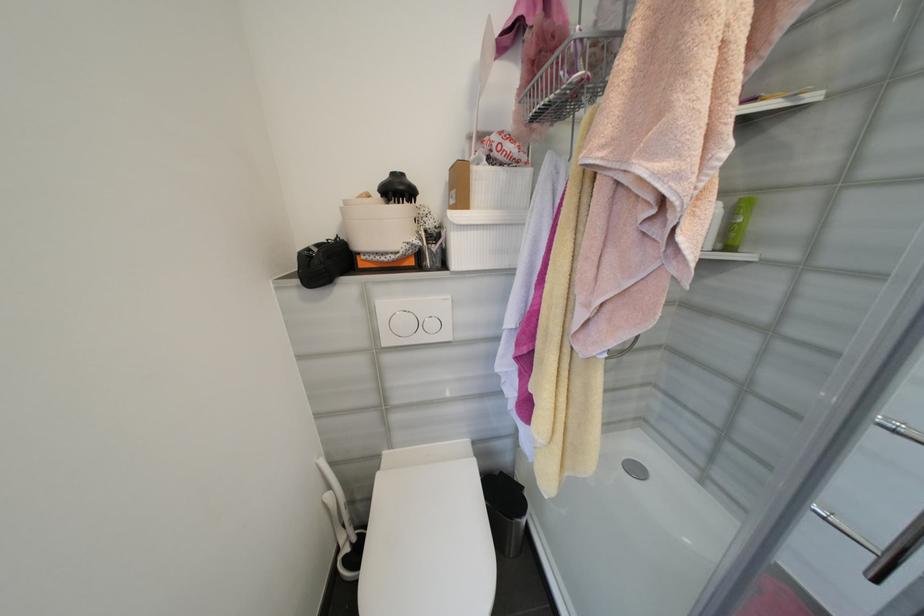
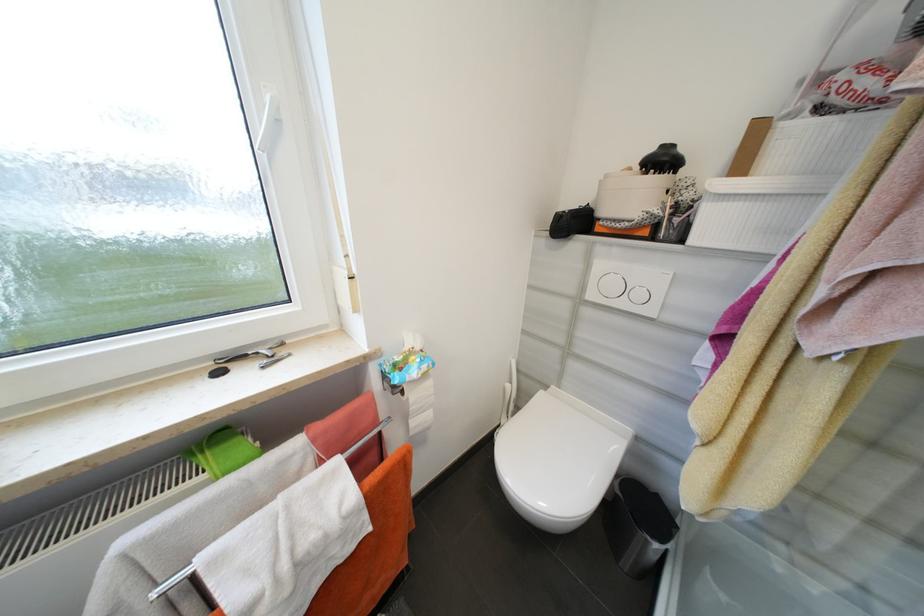
Find the pixel in the second image that matches the point at 422,243 in the first image.

(663, 213)